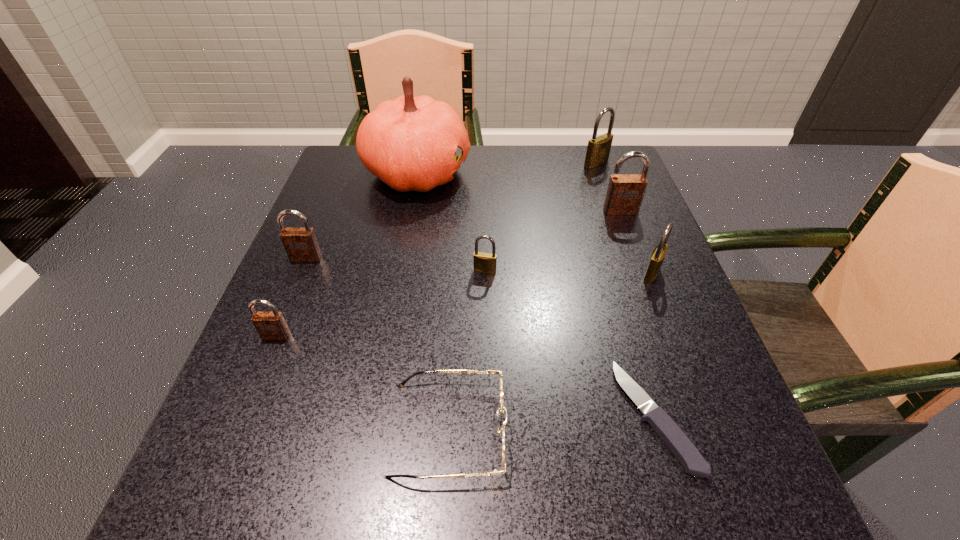
Locate an element on the screen. pink pumpkin is located at coordinates (410, 143).

What are the coordinates of `pumpkin` in the screenshot? It's located at (410, 143).

At what (x,y) coordinates should I click in order to perform the action: click on the farthest brass padlock. Please return your answer as a coordinate pair (x, y). Looking at the image, I should click on (598, 150).

Identify the location of the biggest brass padlock. The image size is (960, 540). (598, 150).

Image resolution: width=960 pixels, height=540 pixels. Find the location of `the farthest brown padlock`. the farthest brown padlock is located at coordinates (625, 192).

The image size is (960, 540). I want to click on the biggest brown padlock, so pos(625,192).

Locate an element on the screen. The height and width of the screenshot is (540, 960). the second biggest brass padlock is located at coordinates (658, 255).

You are a GUI agent. You are given a task and a screenshot of the screen. Output one action in this format:
    pyautogui.click(x=<x>, y=<y>)
    Task: Click on the fourth farthest object
    The width and height of the screenshot is (960, 540).
    Given the screenshot: What is the action you would take?
    pyautogui.click(x=300, y=243)

Where is `the second nearest brown padlock`? This screenshot has height=540, width=960. the second nearest brown padlock is located at coordinates (300, 243).

Where is `the leftmost brass padlock`? Image resolution: width=960 pixels, height=540 pixels. the leftmost brass padlock is located at coordinates (485, 263).